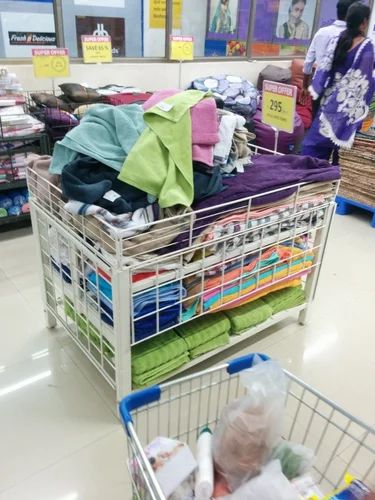
The height and width of the screenshot is (500, 375). I want to click on black dump bins against the back wall, so click(x=45, y=105), click(x=15, y=114).